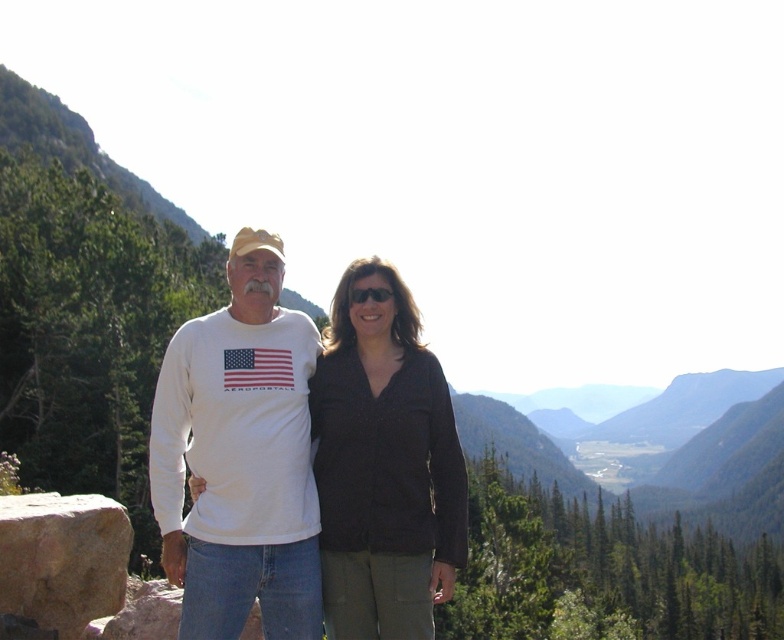
I want to click on black matte shirt at center, so click(383, 465).

Does black matte shirt at center appear on the left side of brown rough stone at lower left?

In fact, black matte shirt at center is to the right of brown rough stone at lower left.

Identify the location of black matte shirt at center. (383, 465).

The width and height of the screenshot is (784, 640). I want to click on black matte shirt at center, so click(383, 465).

Does white cotton t-shirt at left have a greater height compared to black matte shirt at center?

Indeed, white cotton t-shirt at left has a greater height compared to black matte shirt at center.

From the picture: Who is positioned more to the right, white cotton t-shirt at left or black matte shirt at center?

black matte shirt at center is more to the right.

You are a GUI agent. You are given a task and a screenshot of the screen. Output one action in this format:
    pyautogui.click(x=<x>, y=<y>)
    Task: Click on the white cotton t-shirt at left
    
    Given the screenshot: What is the action you would take?
    pyautogui.click(x=238, y=458)

At what (x,y) coordinates should I click in order to perform the action: click on white cotton t-shirt at left. Please return your answer as a coordinate pair (x, y). Looking at the image, I should click on (238, 458).

Which is more to the left, white cotton t-shirt at left or brown rough stone at lower left?

From the viewer's perspective, white cotton t-shirt at left appears more on the left side.

Does white cotton t-shirt at left appear on the left side of brown rough stone at lower left?

Correct, you'll find white cotton t-shirt at left to the left of brown rough stone at lower left.

Is point (231, 337) positioned in front of point (20, 541)?

Yes, point (231, 337) is closer to viewer.

Where is `white cotton t-shirt at left`? The width and height of the screenshot is (784, 640). white cotton t-shirt at left is located at coordinates point(238,458).